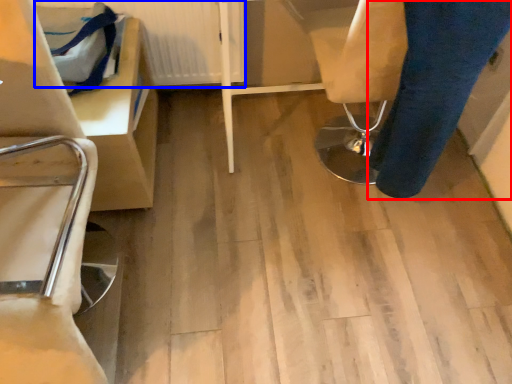
Question: Which object appears closest to the camera in this image, trousers (highlighted by a red box) or radiator (highlighted by a blue box)?

Choices:
 (A) trousers
 (B) radiator

Answer: (A)